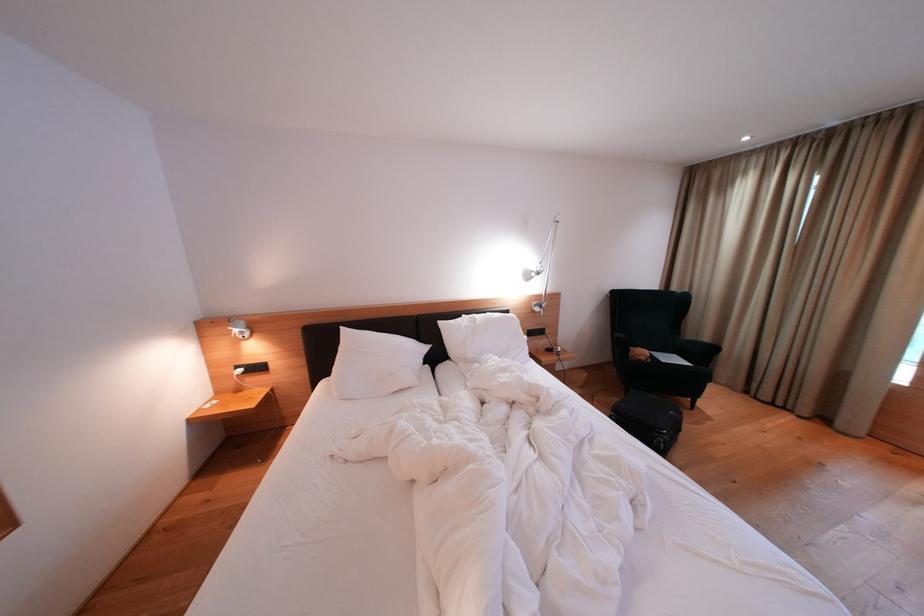
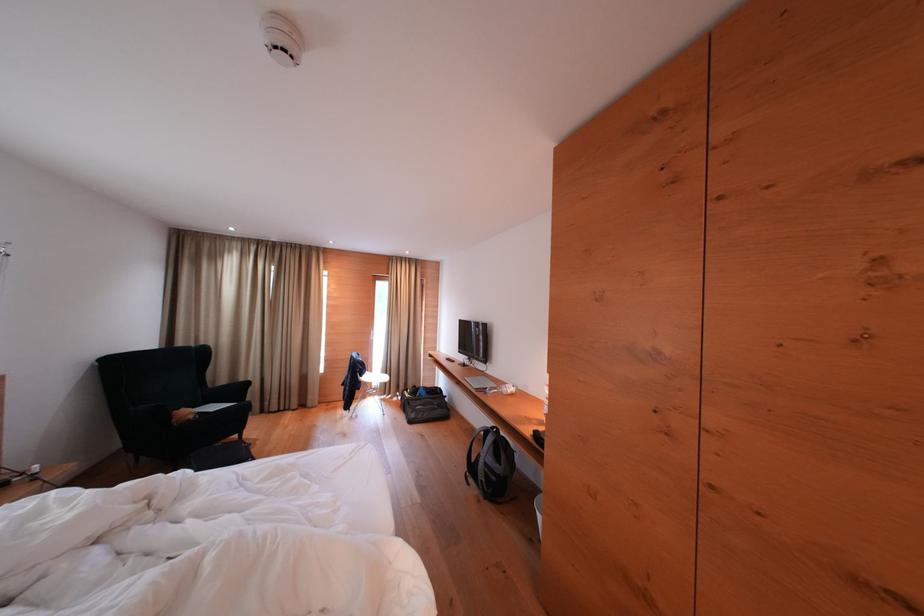
Find the pixel in the second image that matches [649,362] in the first image.

(198, 421)